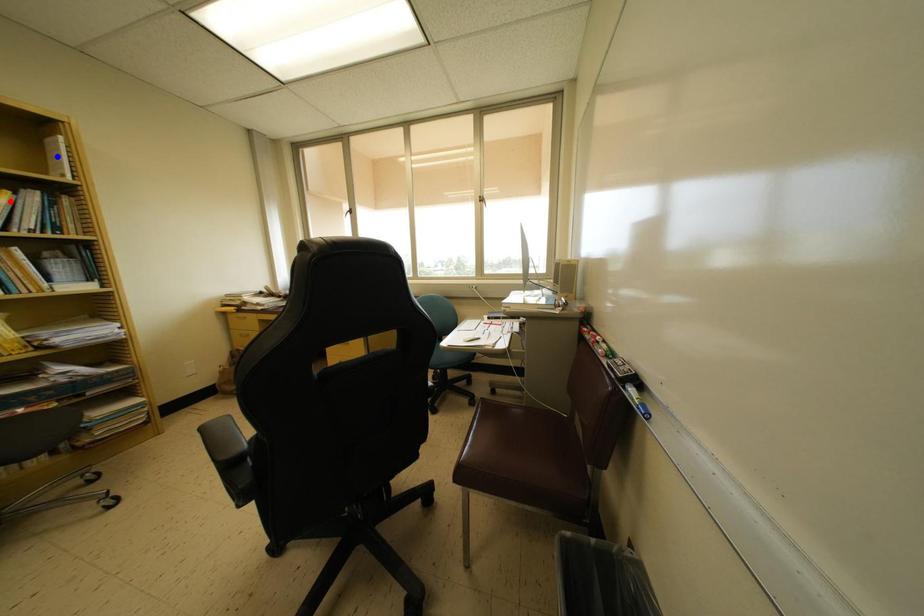
Question: Two points are marked on the image. Which point is closer to the camera?

Choices:
 (A) Blue point is closer.
 (B) Red point is closer.

Answer: (B)